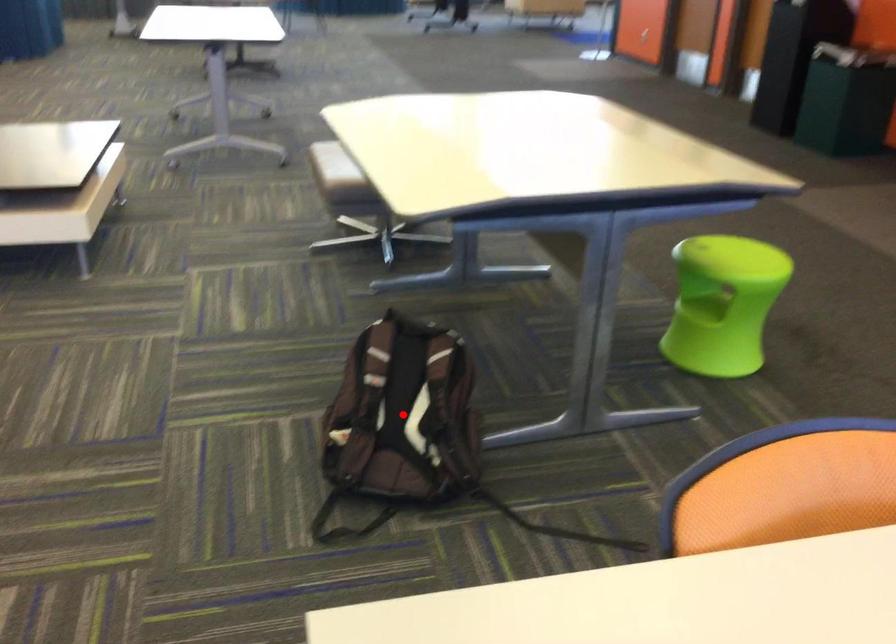
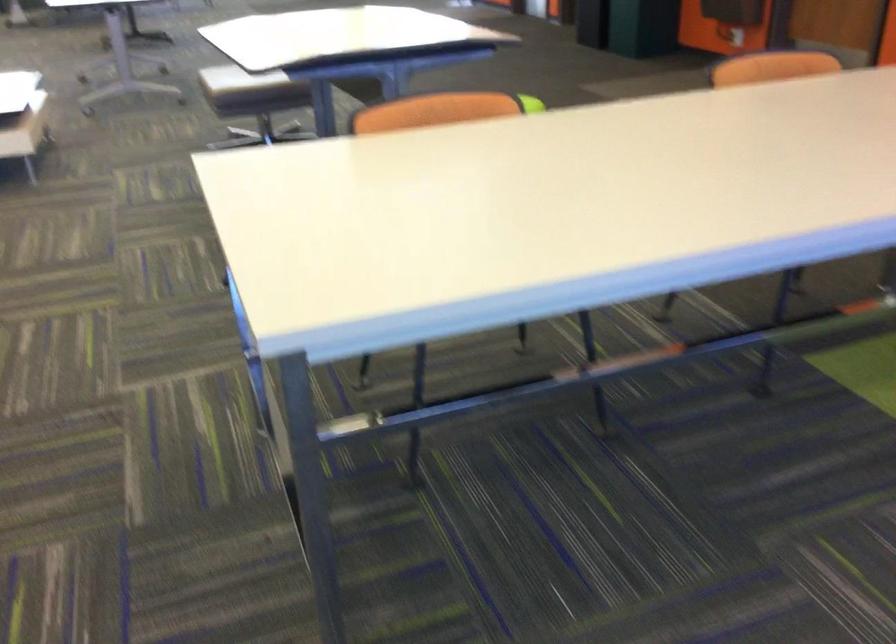
Question: I am providing you with two images of the same scene from different viewpoints. A red point is marked on the first image. Can you still see the location of the red point in image 2?

Choices:
 (A) Yes
 (B) No

Answer: (B)